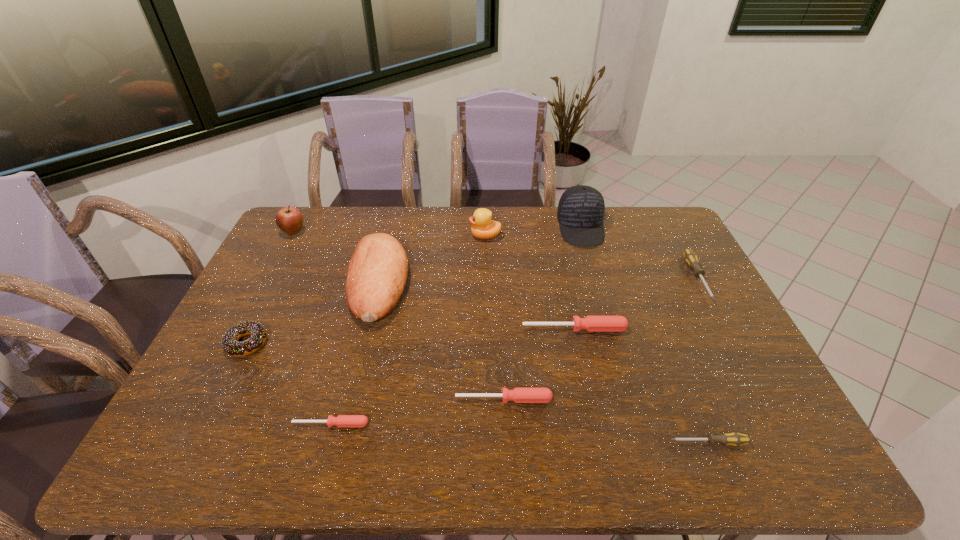
The width and height of the screenshot is (960, 540). Identify the location of free space that is in between the baseball cap and the leftmost screwdriver. click(x=456, y=326).

You are a GUI agent. You are given a task and a screenshot of the screen. Output one action in this format:
    pyautogui.click(x=<x>, y=<y>)
    Task: Click on the free space between the farthest screwdriver and the yellow duckling
    The height and width of the screenshot is (540, 960).
    Given the screenshot: What is the action you would take?
    pyautogui.click(x=591, y=257)

Identify which object is the eighth closest to the baseball cap. Please provide its 2D coordinates. Your answer should be formatted as a tuple, i.e. [(x, y)], where the tuple contains the x and y coordinates of a point satisfying the conditions above.

[(289, 219)]

The width and height of the screenshot is (960, 540). Identify the location of the sixth closest object to the nearest screwdriver. (377, 272).

This screenshot has width=960, height=540. In order to click on screwdriver that is the second nearest to the apple in this screenshot , I will do (590, 323).

Where is `screwdriver that is the third closest to the smaller gray screwdriver`? This screenshot has height=540, width=960. screwdriver that is the third closest to the smaller gray screwdriver is located at coordinates (690, 257).

Locate which red screwdriver is the second closest to the leftmost red screwdriver. Please provide its 2D coordinates. Your answer should be formatted as a tuple, i.e. [(x, y)], where the tuple contains the x and y coordinates of a point satisfying the conditions above.

[(590, 323)]

In order to click on red screwdriver that is the second closest one to the red apple in this screenshot , I will do `click(590, 323)`.

Image resolution: width=960 pixels, height=540 pixels. Identify the location of free region that satisfies the following two spatial constraints: 1. at the front of the tallest object where the brim is located; 2. on the face of the duckling. (x=583, y=236).